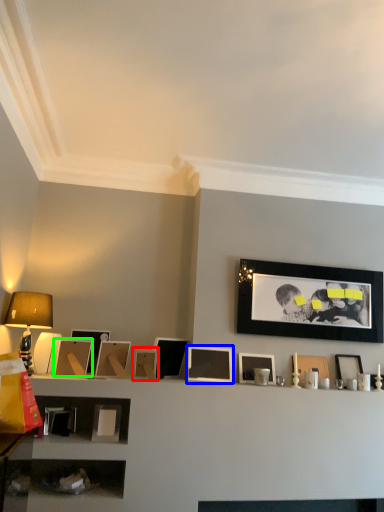
Question: Which object is positioned closest to picture frame (highlighted by a red box)? Select from picture frame (highlighted by a blue box) and picture frame (highlighted by a green box).

Choices:
 (A) picture frame
 (B) picture frame

Answer: (A)